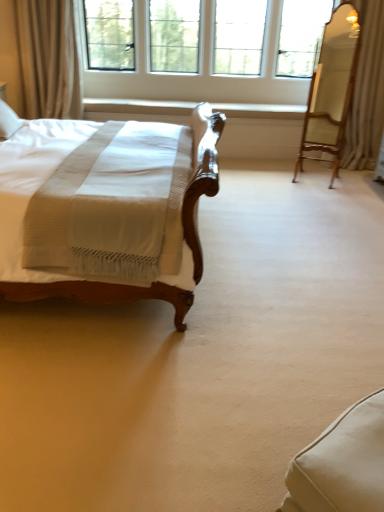
Question: Does clear glass window at upper center appear on the left side of white textured curtain at upper right, which appears as the first curtain when viewed from the right?

Choices:
 (A) no
 (B) yes

Answer: (B)

Question: Is clear glass window at upper center shorter than white textured curtain at upper right, which appears as the first curtain when viewed from the right?

Choices:
 (A) yes
 (B) no

Answer: (A)

Question: Is clear glass window at upper center smaller than white textured curtain at upper right, which appears as the first curtain when viewed from the right?

Choices:
 (A) no
 (B) yes

Answer: (A)

Question: Is clear glass window at upper center further to the viewer compared to white textured curtain at upper right, the second curtain from the left?

Choices:
 (A) no
 (B) yes

Answer: (B)

Question: From a real-world perspective, is clear glass window at upper center on white textured curtain at upper right, which appears as the first curtain when viewed from the right?

Choices:
 (A) yes
 (B) no

Answer: (A)

Question: Is clear glass window at upper center taller or shorter than wooden swivel chair at right, which appears as the 2th swivel chair when viewed from the left?

Choices:
 (A) tall
 (B) short

Answer: (B)

Question: From the image's perspective, is clear glass window at upper center above or below wooden swivel chair at right, marked as the first swivel chair in a back-to-front arrangement?

Choices:
 (A) above
 (B) below

Answer: (A)

Question: Is clear glass window at upper center bigger or smaller than wooden swivel chair at right, the 2th swivel chair in the front-to-back sequence?

Choices:
 (A) big
 (B) small

Answer: (A)

Question: Is point (254, 89) positioned closer to the camera than point (306, 115)?

Choices:
 (A) closer
 (B) farther

Answer: (B)

Question: Is white fabric swivel chair at lower right, which is the 1th swivel chair from front to back, bigger or smaller than beige fabric curtain at upper left, arranged as the 1th curtain when viewed from the left?

Choices:
 (A) big
 (B) small

Answer: (B)

Question: From the image's perspective, is white fabric swivel chair at lower right, marked as the second swivel chair in a back-to-front arrangement, positioned above or below beige fabric curtain at upper left, arranged as the 1th curtain when viewed from the left?

Choices:
 (A) below
 (B) above

Answer: (A)

Question: Visually, is white fabric swivel chair at lower right, marked as the second swivel chair in a back-to-front arrangement, positioned to the left or to the right of beige fabric curtain at upper left, arranged as the 1th curtain when viewed from the left?

Choices:
 (A) right
 (B) left

Answer: (A)

Question: Relative to beige fabric curtain at upper left, the second curtain viewed from the right, is white fabric swivel chair at lower right, which is the second swivel chair from top to bottom, in front or behind?

Choices:
 (A) front
 (B) behind

Answer: (A)

Question: Based on their sizes in the image, would you say beige fabric curtain at upper left, arranged as the 1th curtain when viewed from the left, is bigger or smaller than wooden swivel chair at right, which appears as the 2th swivel chair when viewed from the left?

Choices:
 (A) small
 (B) big

Answer: (B)

Question: Considering their positions, is beige fabric curtain at upper left, the second curtain viewed from the right, located in front of or behind wooden swivel chair at right, the 2th swivel chair in the front-to-back sequence?

Choices:
 (A) behind
 (B) front

Answer: (A)